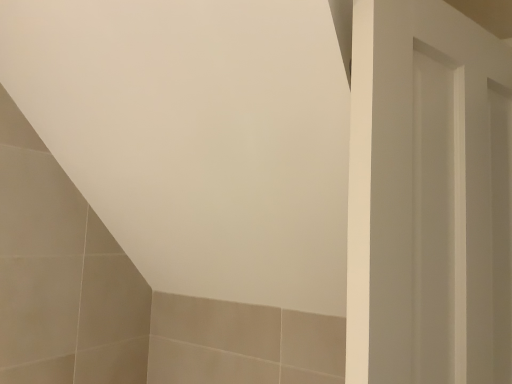
Describe the element at coordinates (420, 194) in the screenshot. I see `white matte door at right` at that location.

You are a GUI agent. You are given a task and a screenshot of the screen. Output one action in this format:
    pyautogui.click(x=<x>, y=<y>)
    Task: Click on the white matte door at right
    The image size is (512, 384).
    Given the screenshot: What is the action you would take?
    pyautogui.click(x=420, y=194)

The image size is (512, 384). In order to click on white matte door at right in this screenshot , I will do `click(420, 194)`.